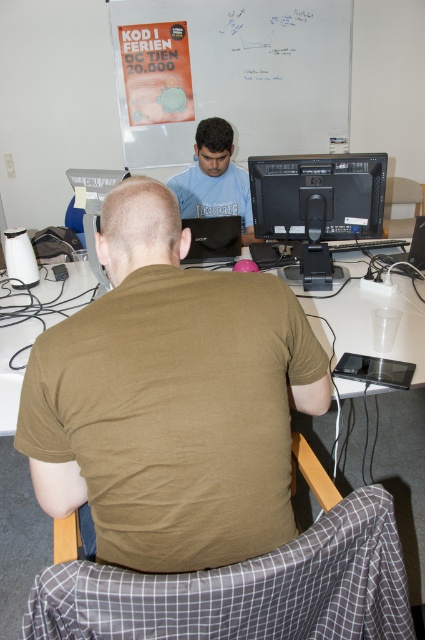
Question: Which point appears farthest from the camera in this image?

Choices:
 (A) (173, 26)
 (B) (325, 205)
 (C) (331, 65)
 (D) (238, 173)

Answer: (C)

Question: Is black glossy monitor at center smaller than matte blue shirt at center?

Choices:
 (A) no
 (B) yes

Answer: (B)

Question: Which object appears closest to the camera in this image?

Choices:
 (A) whiteboard at upper center
 (B) white plastic table at center
 (C) brown cotton shirt at center
 (D) matte paper poster at upper center

Answer: (C)

Question: Which point appears farthest from the camera in this image?

Choices:
 (A) (283, 51)
 (B) (379, 493)
 (C) (204, 170)
 (D) (47, 294)

Answer: (A)

Question: Can you confirm if brown cotton shirt at center is bigger than black glossy monitor at center?

Choices:
 (A) no
 (B) yes

Answer: (B)

Question: Does brown cotton shirt at center come behind whiteboard at upper center?

Choices:
 (A) no
 (B) yes

Answer: (A)